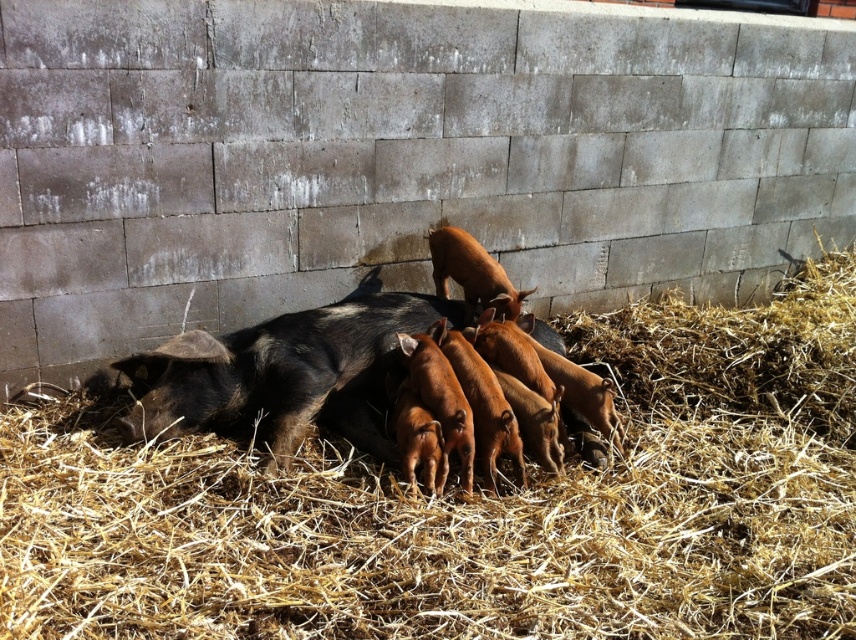
Question: Is brown straw at center wider than shiny black sow with reddish-brown piglets at center?

Choices:
 (A) no
 (B) yes

Answer: (B)

Question: Can you confirm if brown straw at center is positioned to the right of shiny black sow with reddish-brown piglets at center?

Choices:
 (A) yes
 (B) no

Answer: (A)

Question: Which point is farther to the camera?

Choices:
 (A) brown straw at center
 (B) shiny black sow at center
 (C) shiny black sow with reddish-brown piglets at center

Answer: (B)

Question: Which point is closer to the camera?

Choices:
 (A) brown straw at center
 (B) shiny black sow at center

Answer: (A)

Question: Which of the following is the farthest from the observer?

Choices:
 (A) (4, 488)
 (B) (135, 428)
 (C) (391, 298)

Answer: (C)

Question: Is shiny black sow with reddish-brown piglets at center below shiny black sow at center?

Choices:
 (A) no
 (B) yes

Answer: (A)